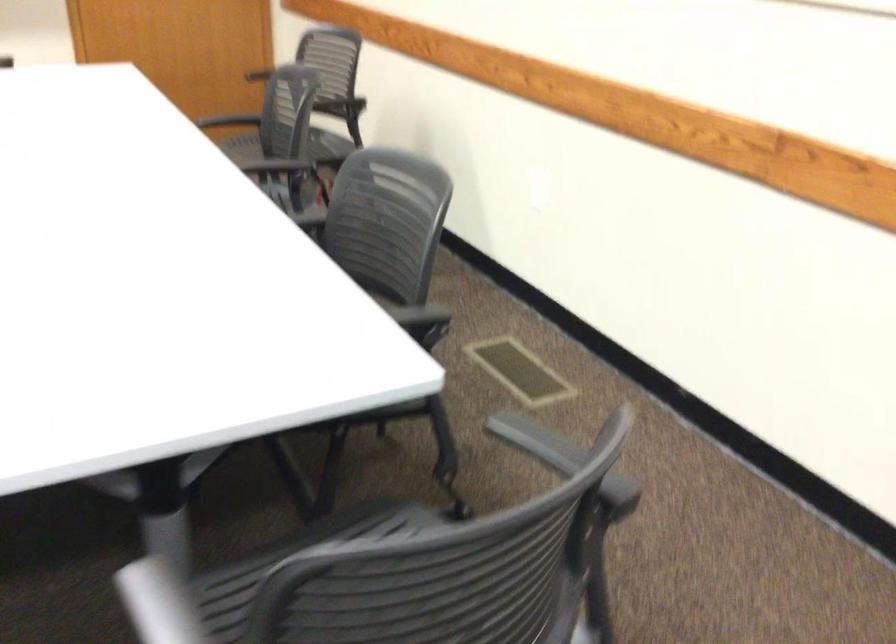
Image resolution: width=896 pixels, height=644 pixels. Describe the element at coordinates (520, 370) in the screenshot. I see `the grey plastic part` at that location.